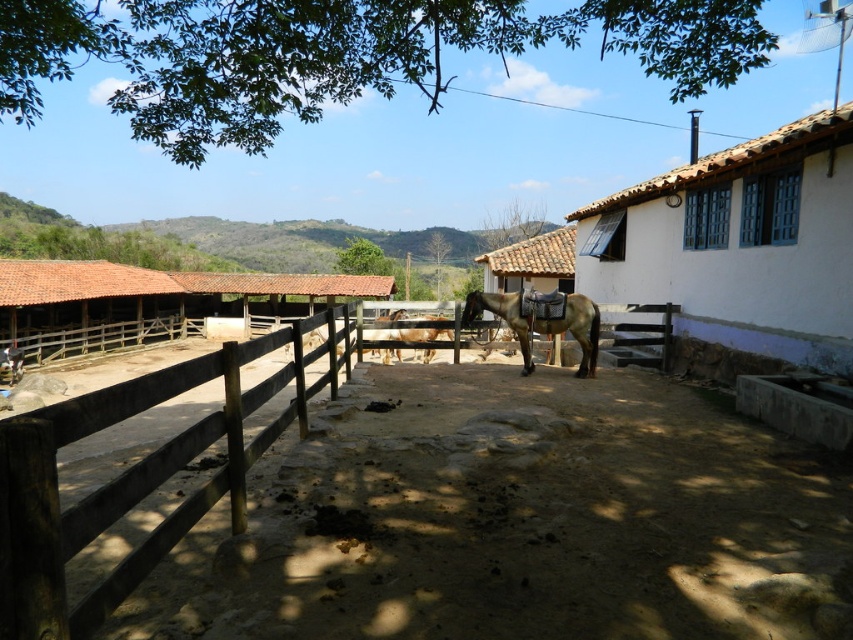
Can you confirm if brown tile hut at left is positioned below brown glossy horse at center?

Actually, brown tile hut at left is above brown glossy horse at center.

Does point (76, 353) come behind point (399, 332)?

Yes.

Find the location of `brown tile hut at left`. brown tile hut at left is located at coordinates (86, 307).

Between brown tile hut at left and brown leather horse at center, which one is positioned higher?

Positioned higher is brown tile hut at left.

Can you confirm if brown tile hut at left is smaller than brown leather horse at center?

Actually, brown tile hut at left might be larger than brown leather horse at center.

Image resolution: width=853 pixels, height=640 pixels. Describe the element at coordinates (86, 307) in the screenshot. I see `brown tile hut at left` at that location.

What are the coordinates of `brown tile hut at left` in the screenshot? It's located at (86, 307).

Is brown leather horse at center taller than brown glossy horse at center?

Correct, brown leather horse at center is much taller as brown glossy horse at center.

Which is in front, point (554, 332) or point (393, 316)?

Point (554, 332)

Does point (552, 326) come behind point (383, 317)?

No, (552, 326) is in front of (383, 317).

Locate an element on the screen. This screenshot has width=853, height=640. brown leather horse at center is located at coordinates (543, 321).